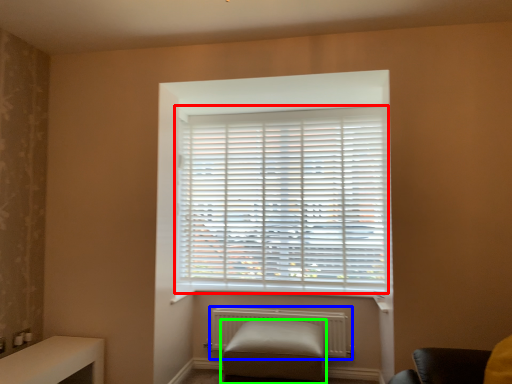
Question: Considering the real-world distances, which object is closest to window blind (highlighted by a red box)? radiator (highlighted by a blue box) or furniture (highlighted by a green box).

Choices:
 (A) radiator
 (B) furniture

Answer: (A)